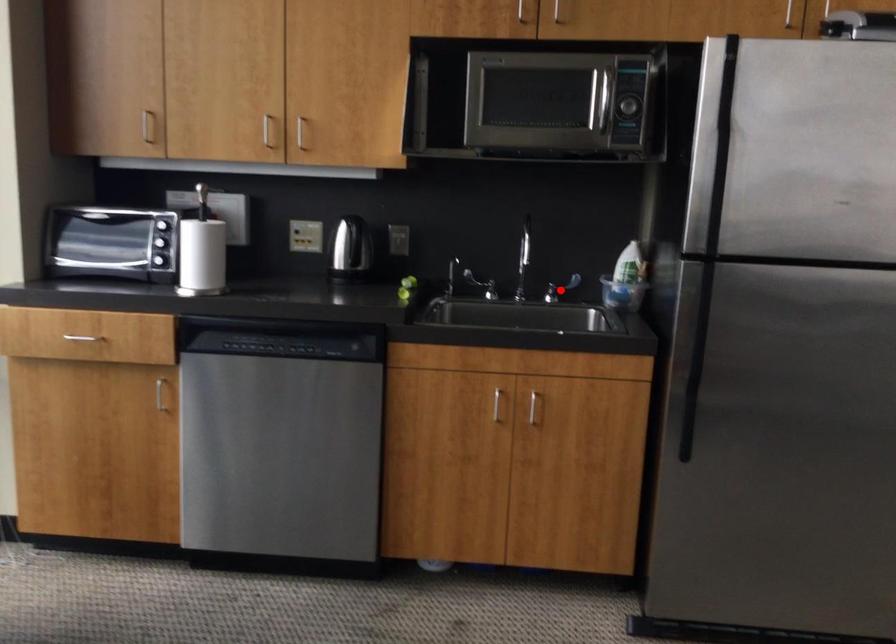
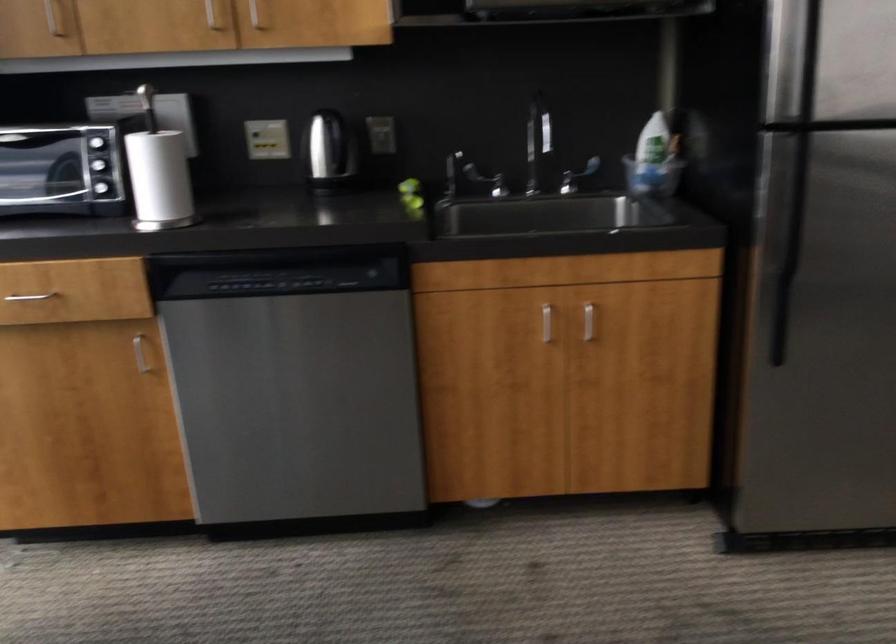
Question: I am providing you with two images of the same scene from different viewpoints. Given a red point in image1, look at the same physical point in image2. Is it:

Choices:
 (A) Closer to the viewpoint
 (B) Farther from the viewpoint

Answer: (A)